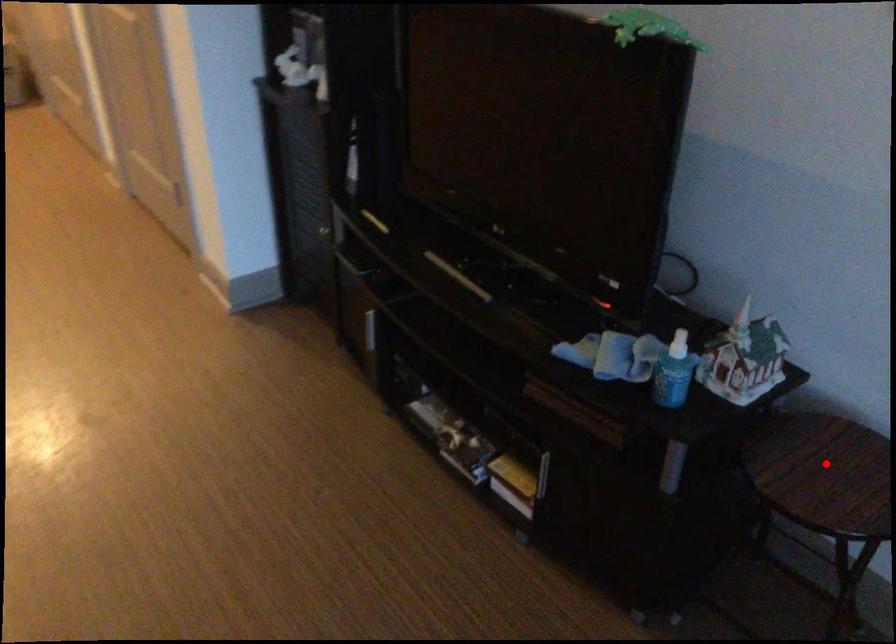
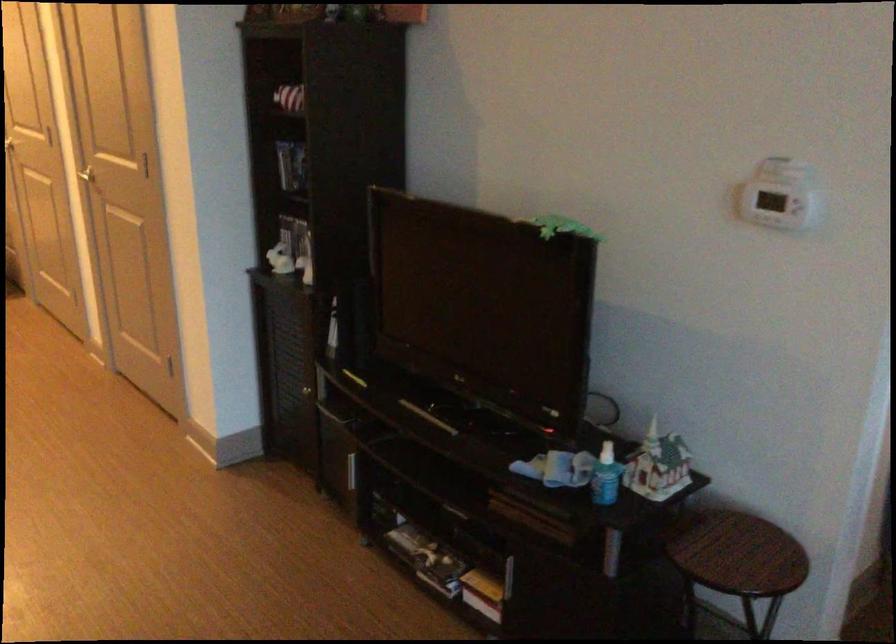
Question: A red point is marked in image1. In image2, is the corresponding 3D point closer to the camera or farther? Reply with the corresponding letter.

Choices:
 (A) The corresponding 3D point is closer.
 (B) The corresponding 3D point is farther.

Answer: (B)